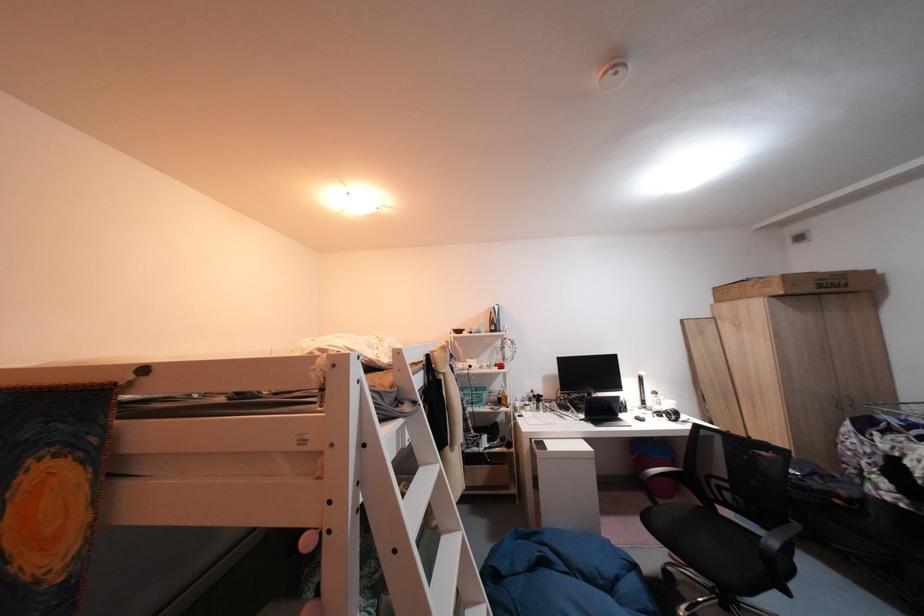
Where would you open the large cardboard box? Please return your answer as a coordinate pair (x, y).

(799, 285)